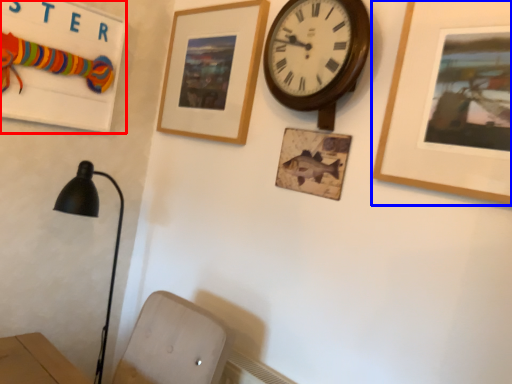
Question: Among these objects, which one is farthest to the camera, bulletin board (highlighted by a red box) or picture frame (highlighted by a blue box)?

Choices:
 (A) bulletin board
 (B) picture frame

Answer: (A)